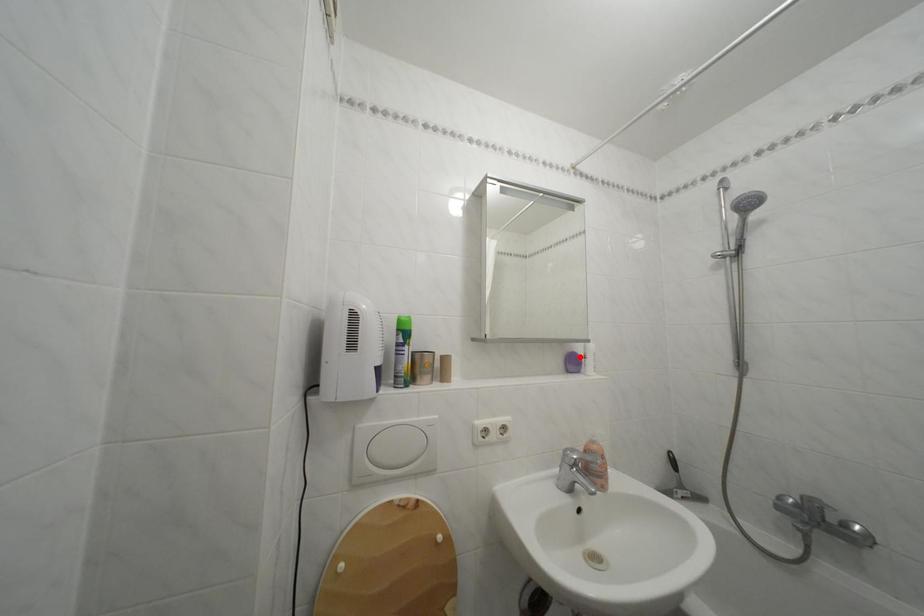
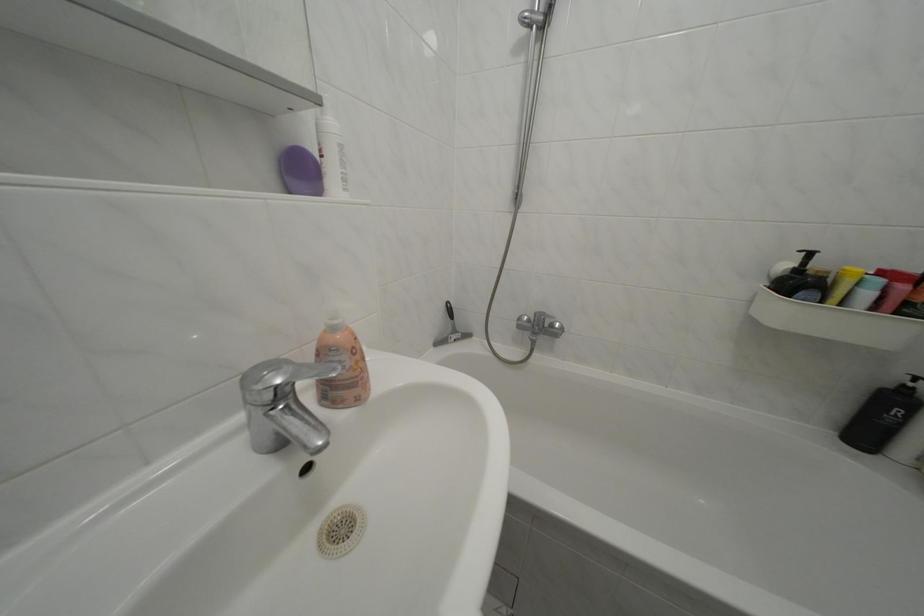
In the second image, find the point that corresponds to the highlighted location in the first image.

(301, 150)